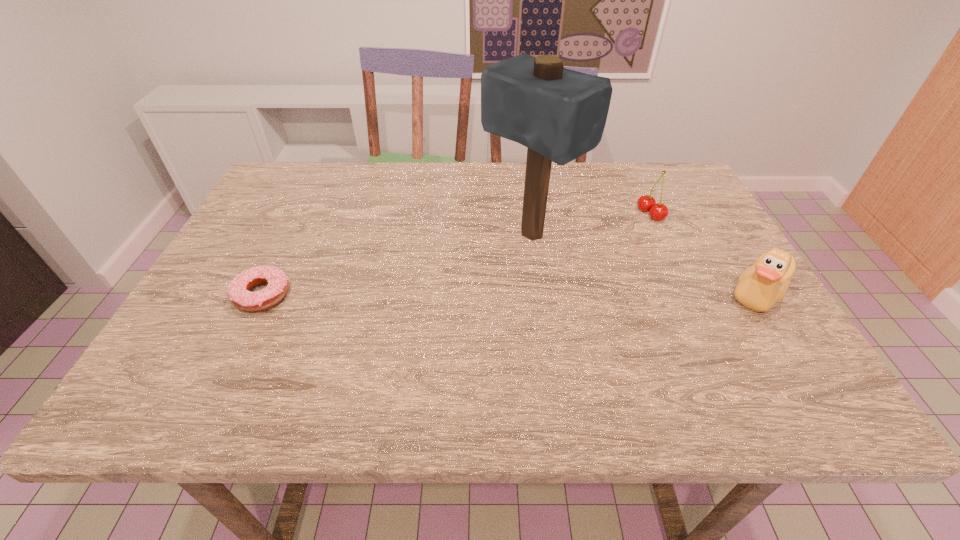
Select which object is the closest to the mallet. Please provide its 2D coordinates. Your answer should be formatted as a tuple, i.e. [(x, y)], where the tuple contains the x and y coordinates of a point satisfying the conditions above.

[(646, 203)]

Identify the location of vacant area in the image that satisfies the following two spatial constraints: 1. on the back side of the doughnut; 2. at the beak of the duck. This screenshot has width=960, height=540. (264, 293).